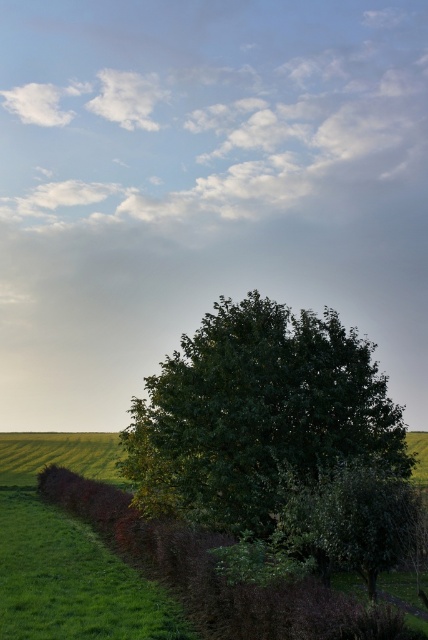
Is point (335, 388) positioned after point (219, 600)?

Yes, point (335, 388) is behind point (219, 600).

Is point (357, 410) positioned behind point (143, 540)?

Yes, point (357, 410) is farther from viewer.

Identify the location of green leafy tree at center. Image resolution: width=428 pixels, height=640 pixels. (258, 413).